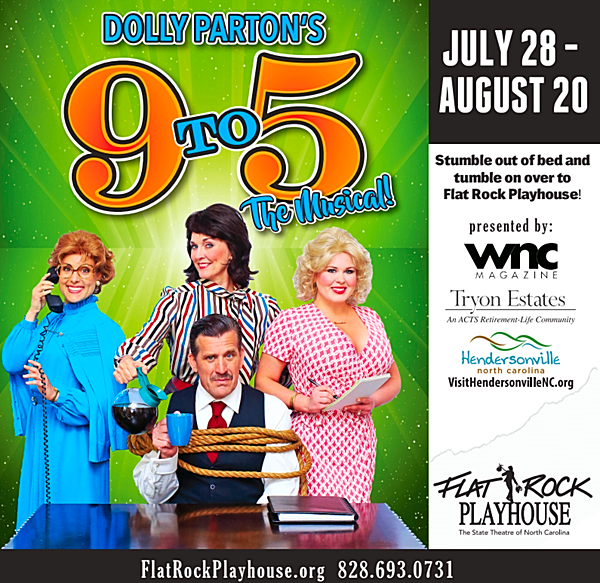
At what (x,y) coordinates should I click in order to perform the action: click on phone receiver on center left. Please return your answer as a coordinate pair (x, y). Looking at the image, I should click on (55, 304).